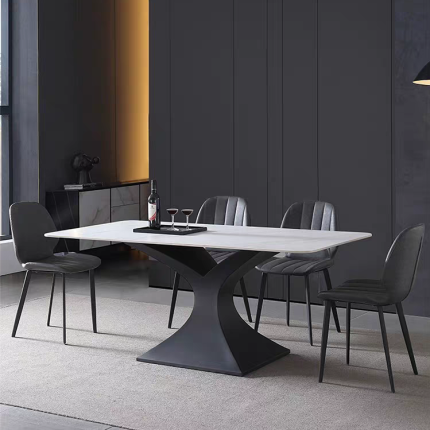
At what (x,y) coordinates should I click in order to perform the action: click on table. Please return your answer as a coordinate pair (x, y). This screenshot has height=430, width=430. Looking at the image, I should click on (224, 243).